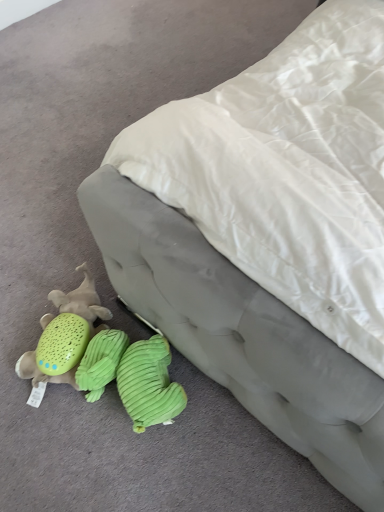
Identify the location of green corduroy stuffed toy at lower left. The height and width of the screenshot is (512, 384). (102, 358).

The height and width of the screenshot is (512, 384). Describe the element at coordinates (102, 358) in the screenshot. I see `green corduroy stuffed toy at lower left` at that location.

Locate an element on the screen. The width and height of the screenshot is (384, 512). green corduroy stuffed toy at lower left is located at coordinates (102, 358).